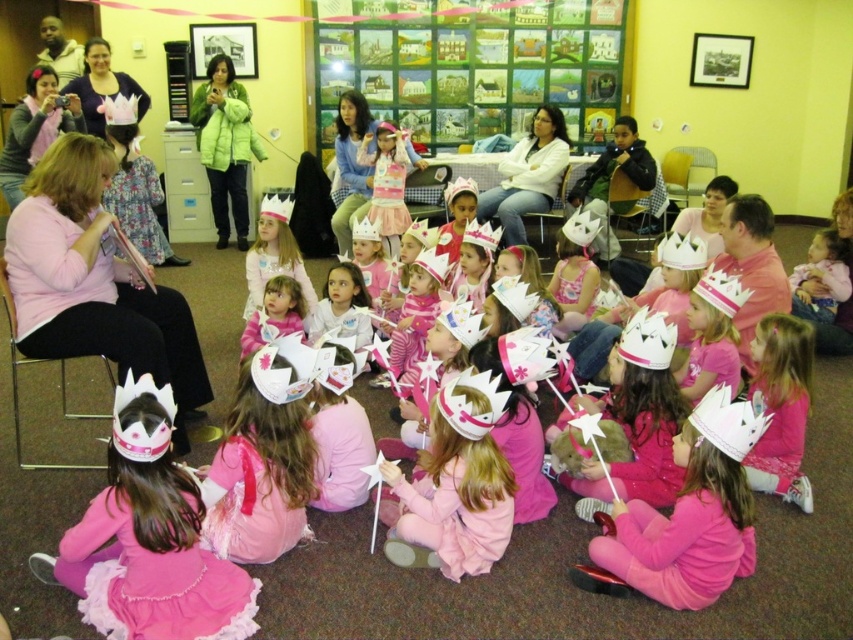
You are a photographer trying to capture a group photo of the children in the scene. You notice the pink satin dress at center and the matte pink crown at upper left. Which object is taller and might require adjusting the camera angle to ensure both are fully visible?

The pink satin dress at center is taller than the matte pink crown at upper left, so adjusting the camera angle to account for its height would help ensure both are fully visible.

You are a photographer trying to capture a photo of the children in the scene. You want to ensure both the matte pink crown at lower right and the pink satin dress at center are clearly visible in the frame. Based on their positions, which object is closer to the camera?

The matte pink crown at lower right is in front of the pink satin dress at center, so it is closer to the camera and will be more visible in the photo.

Looking at this image, you are a photographer standing at the back of the room. You want to take a photo that includes both the pink satin dress at center and the matte pink crown at upper left. Can you position yourself so that both objects are in the frame without moving any of them?

The distance between the pink satin dress at center and the matte pink crown at upper left is 6.97 feet. Since the photographer is at the back, they can position themselves to capture both objects in the frame as the distance is manageable within a typical camera lens range.